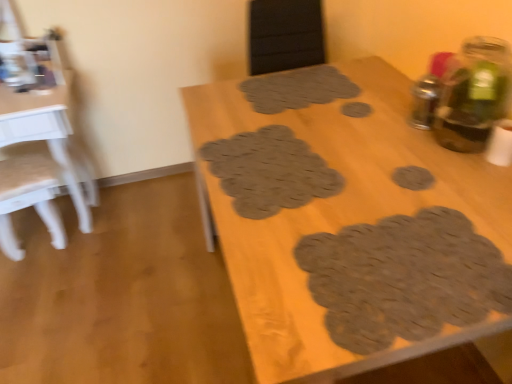
Identify the location of vacant space situated above brown textured mat at center, the 5th footprint from the front (from a real-world perspective). (298, 89).